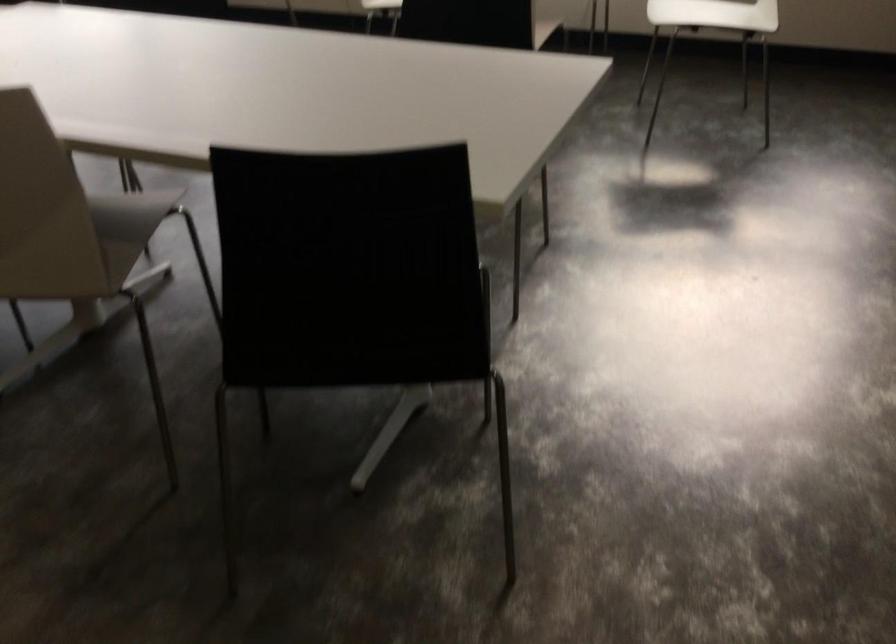
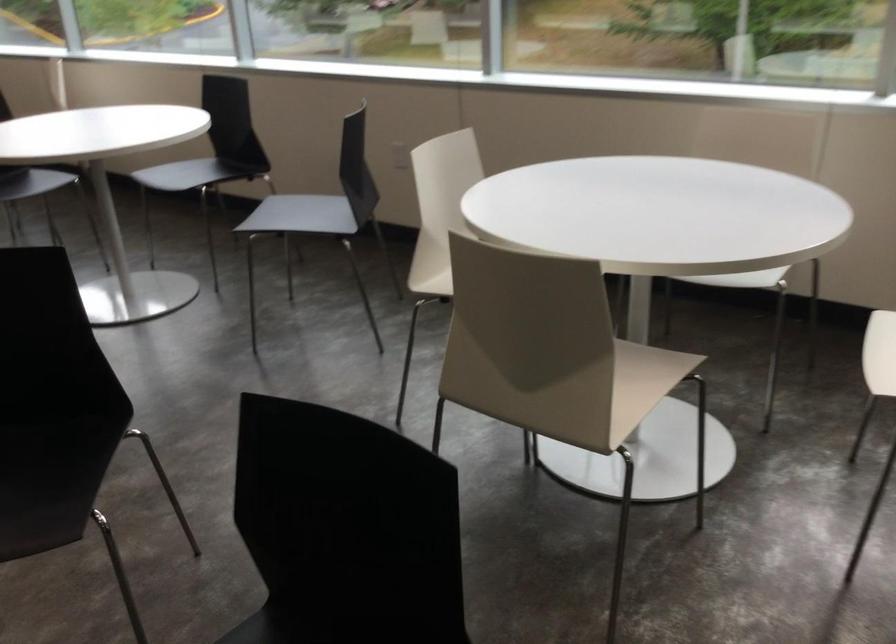
Question: Which direction would the cameraman need to move to produce the second image? Reply with the corresponding letter.

Choices:
 (A) Left
 (B) Right
 (C) Forward
 (D) Backward

Answer: (C)